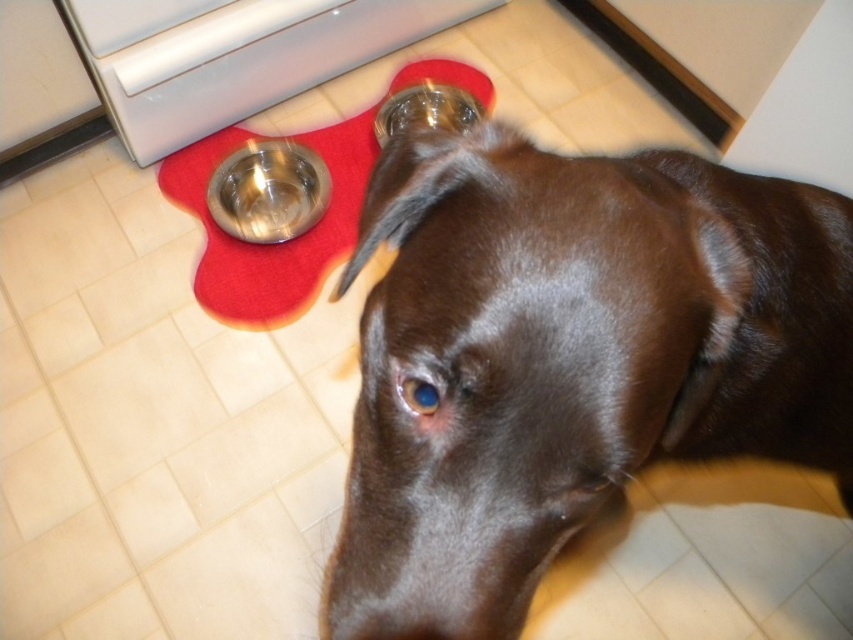
Question: Which of the following is the closest to the observer?

Choices:
 (A) (218, 132)
 (B) (459, 333)

Answer: (B)

Question: Which point appears farthest from the camera in this image?

Choices:
 (A) (393, 630)
 (B) (142, 120)

Answer: (B)

Question: Is white glossy oven at upper left above red felt mat at center?

Choices:
 (A) no
 (B) yes

Answer: (B)

Question: Is shiny brown fur at center smaller than red felt mat at center?

Choices:
 (A) no
 (B) yes

Answer: (B)

Question: Is white glossy oven at upper left in front of red felt mat at center?

Choices:
 (A) no
 (B) yes

Answer: (B)

Question: Based on their relative distances, which object is farther from the red felt mat at center?

Choices:
 (A) shiny brown fur at center
 (B) white glossy oven at upper left

Answer: (A)